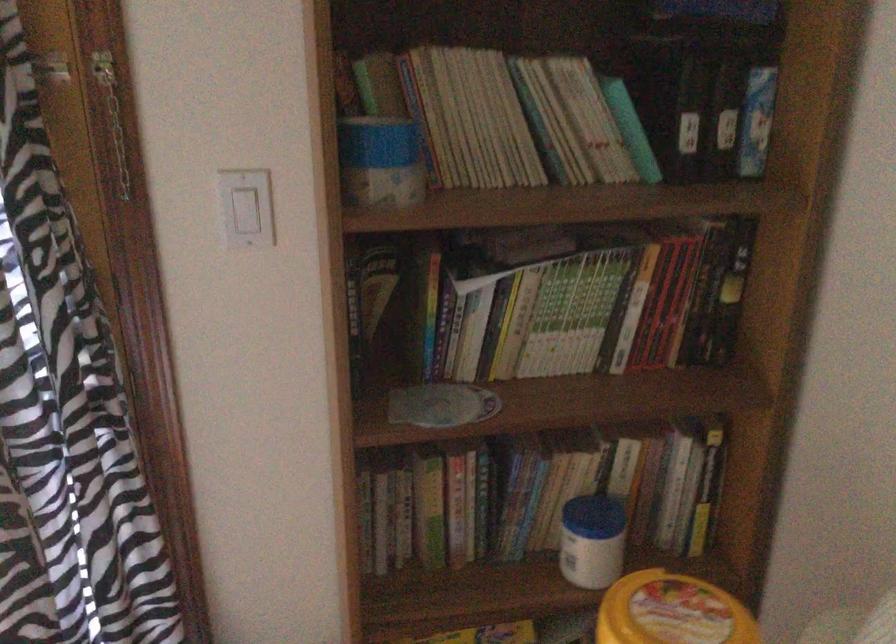
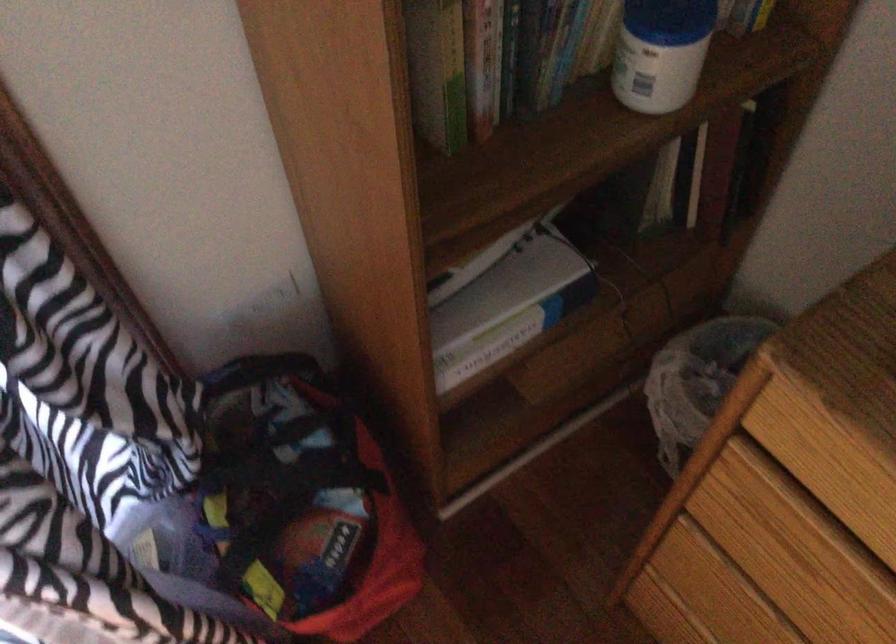
Question: How did the camera likely rotate?

Choices:
 (A) Left
 (B) Right
 (C) Up
 (D) Down

Answer: (D)